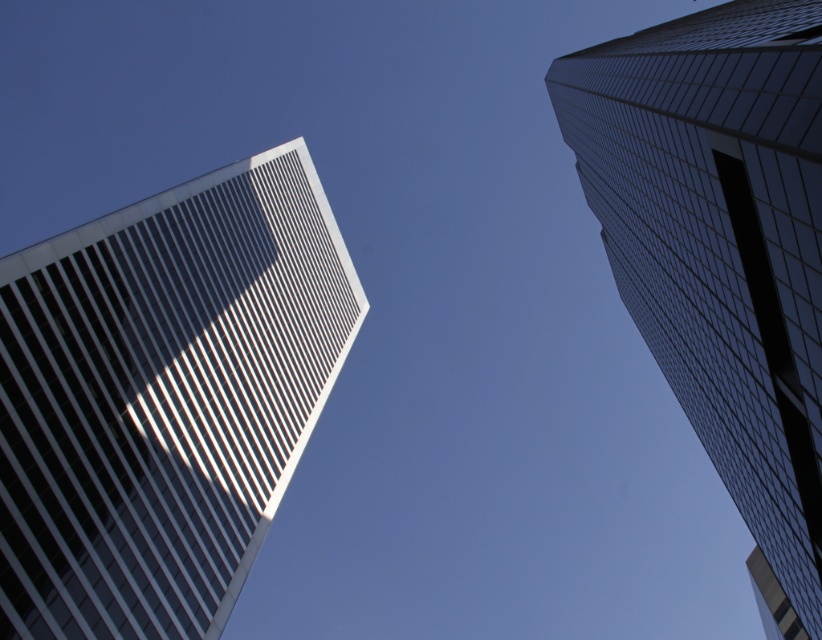
Question: Does white glass building at upper left appear under glassy reflective skyscraper at upper right?

Choices:
 (A) no
 (B) yes

Answer: (B)

Question: Which point appears closest to the camera in this image?

Choices:
 (A) (299, 406)
 (B) (762, 35)

Answer: (B)

Question: Is white glass building at upper left thinner than glassy reflective skyscraper at upper right?

Choices:
 (A) yes
 (B) no

Answer: (A)

Question: Does white glass building at upper left come behind glassy reflective skyscraper at upper right?

Choices:
 (A) yes
 (B) no

Answer: (A)